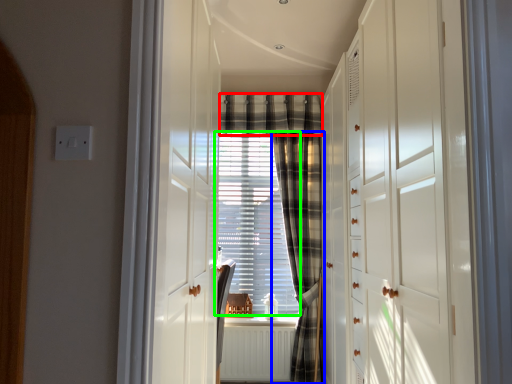
Question: Which is nearer to the plaid (highlighted by a red box)? curtain (highlighted by a blue box) or window screen (highlighted by a green box).

Choices:
 (A) curtain
 (B) window screen

Answer: (A)